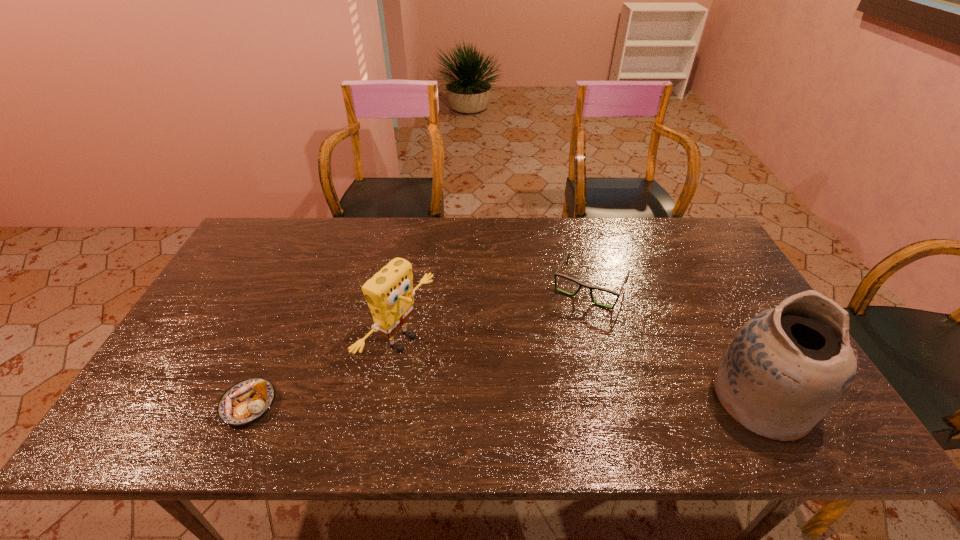
Where is `free spot at the near edge of the desktop`? The height and width of the screenshot is (540, 960). free spot at the near edge of the desktop is located at coordinates (550, 389).

This screenshot has width=960, height=540. I want to click on vacant area at the left edge, so click(211, 353).

Find the location of a particular element. This screenshot has width=960, height=540. free space at the right edge of the desktop is located at coordinates (709, 325).

At what (x,y) coordinates should I click in order to perform the action: click on blank area at the far left corner. Please return your answer as a coordinate pair (x, y). This screenshot has width=960, height=540. Looking at the image, I should click on (268, 240).

The width and height of the screenshot is (960, 540). Find the location of `blank space at the far right corner of the desktop`. blank space at the far right corner of the desktop is located at coordinates (674, 255).

Where is `blank region between the third tallest object and the leftmost object`? The width and height of the screenshot is (960, 540). blank region between the third tallest object and the leftmost object is located at coordinates (420, 346).

Find the location of a particular element. The image size is (960, 540). vacant space in between the leftmost object and the second shortest object is located at coordinates (420, 346).

The image size is (960, 540). Identify the location of free space between the second object from right to left and the second tallest object. (494, 314).

The width and height of the screenshot is (960, 540). Identify the location of free space between the shortest object and the sponge. (324, 372).

You are a GUI agent. You are given a task and a screenshot of the screen. Output one action in this format:
    pyautogui.click(x=<x>, y=<y>)
    Task: Click on the vacant point located between the leftmost object and the sponge
    
    Given the screenshot: What is the action you would take?
    pyautogui.click(x=324, y=372)